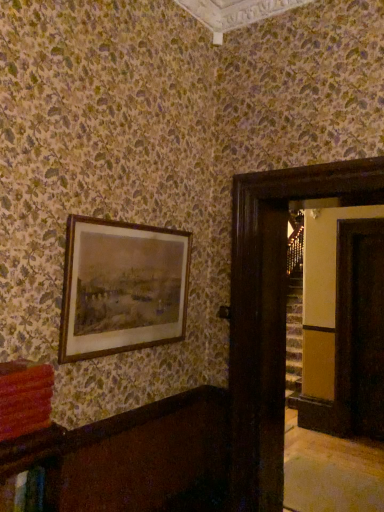
What is the approximate width of dark wood door at right, which ranks as the 2th glass door in right-to-left order?

dark wood door at right, which ranks as the 2th glass door in right-to-left order, is 19.11 inches wide.

This screenshot has height=512, width=384. What are the coordinates of `brown wooden picture frame at upper left` in the screenshot? It's located at (121, 287).

Is point (181, 289) positioned after point (1, 425)?

Yes, point (181, 289) is behind point (1, 425).

Which of these two, brown wooden picture frame at upper left or matte red book at lower left, is thinner?

brown wooden picture frame at upper left.

Does brown wooden picture frame at upper left appear on the right side of matte red book at lower left?

Indeed, brown wooden picture frame at upper left is positioned on the right side of matte red book at lower left.

Does brown wooden picture frame at upper left touch matte red book at lower left?

brown wooden picture frame at upper left is not next to matte red book at lower left, and they're not touching.

From the image's perspective, is transparent glass door at right, the second glass door from the left, below matte red book at lower left?

Indeed, from the image's perspective, transparent glass door at right, the second glass door from the left, is shown beneath matte red book at lower left.

Is transparent glass door at right, the second glass door from the left, bigger than matte red book at lower left?

Yes, transparent glass door at right, the second glass door from the left, is bigger than matte red book at lower left.

From a real-world perspective, is transparent glass door at right, arranged as the first glass door when viewed from the right, above or below matte red book at lower left?

Clearly, from a real-world perspective, transparent glass door at right, arranged as the first glass door when viewed from the right, is below matte red book at lower left.

From the picture: Considering the relative sizes of transparent glass door at right, arranged as the first glass door when viewed from the right, and matte red book at lower left in the image provided, is transparent glass door at right, arranged as the first glass door when viewed from the right, shorter than matte red book at lower left?

No.

Between brown wooden picture frame at upper left and dark wood door at right, which ranks as the 2th glass door in right-to-left order, which one appears on the left side from the viewer's perspective?

brown wooden picture frame at upper left.

Consider the image. From the image's perspective, is brown wooden picture frame at upper left beneath dark wood door at right, acting as the 2th glass door starting from the back?

Actually, brown wooden picture frame at upper left appears above dark wood door at right, acting as the 2th glass door starting from the back, in the image.

Is brown wooden picture frame at upper left completely or partially outside of dark wood door at right, which ranks as the 1th glass door in left-to-right order?

Yes, brown wooden picture frame at upper left is outside of dark wood door at right, which ranks as the 1th glass door in left-to-right order.

Considering the sizes of objects brown wooden picture frame at upper left and dark wood door at right, which ranks as the 1th glass door in left-to-right order, in the image provided, who is wider, brown wooden picture frame at upper left or dark wood door at right, which ranks as the 1th glass door in left-to-right order,?

Wider between the two is dark wood door at right, which ranks as the 1th glass door in left-to-right order.

Between matte red book at lower left and transparent glass door at right, the second glass door when ordered from front to back, which one has more height?

transparent glass door at right, the second glass door when ordered from front to back, is taller.

Is matte red book at lower left in front of or behind transparent glass door at right, the second glass door from the left, in the image?

Clearly, matte red book at lower left is in front of transparent glass door at right, the second glass door from the left.

Is matte red book at lower left turned away from transparent glass door at right, the second glass door from the left?

No, matte red book at lower left is not facing the opposite direction of transparent glass door at right, the second glass door from the left.

Is matte red book at lower left positioned far away from transparent glass door at right, the second glass door when ordered from front to back?

That's right, there is a large distance between matte red book at lower left and transparent glass door at right, the second glass door when ordered from front to back.

Between dark wood door at right, which ranks as the 1th glass door in left-to-right order, and brown wooden picture frame at upper left, which one has smaller width?

brown wooden picture frame at upper left is thinner.

Is brown wooden picture frame at upper left located within dark wood door at right, which ranks as the 1th glass door in left-to-right order?

No.

Is dark wood door at right, which ranks as the 1th glass door in left-to-right order, touching brown wooden picture frame at upper left?

They are not placed beside each other.

Considering the sizes of dark wood door at right, which ranks as the 2th glass door in right-to-left order, and brown wooden picture frame at upper left in the image, is dark wood door at right, which ranks as the 2th glass door in right-to-left order, bigger or smaller than brown wooden picture frame at upper left?

Considering their sizes, dark wood door at right, which ranks as the 2th glass door in right-to-left order, takes up more space than brown wooden picture frame at upper left.

From the image's perspective, between matte red book at lower left and dark wood door at right, acting as the 2th glass door starting from the back, who is located below?

dark wood door at right, acting as the 2th glass door starting from the back, from the image's perspective.

Consider the image. Considering the sizes of objects matte red book at lower left and dark wood door at right, which ranks as the 2th glass door in right-to-left order, in the image provided, who is taller, matte red book at lower left or dark wood door at right, which ranks as the 2th glass door in right-to-left order,?

dark wood door at right, which ranks as the 2th glass door in right-to-left order, is taller.

Considering their positions, is matte red book at lower left located in front of or behind dark wood door at right, placed as the first glass door when sorted from front to back?

matte red book at lower left is positioned closer to the viewer than dark wood door at right, placed as the first glass door when sorted from front to back.

Would you say matte red book at lower left is inside or outside dark wood door at right, which ranks as the 1th glass door in left-to-right order?

matte red book at lower left is outside dark wood door at right, which ranks as the 1th glass door in left-to-right order.

From a real-world perspective, is dark wood door at right, which ranks as the 1th glass door in left-to-right order, physically located above or below transparent glass door at right, which ranks as the 1th glass door in back-to-front order?

dark wood door at right, which ranks as the 1th glass door in left-to-right order, is situated higher than transparent glass door at right, which ranks as the 1th glass door in back-to-front order, in the real world.

How distant is dark wood door at right, placed as the first glass door when sorted from front to back, from transparent glass door at right, the second glass door from the left?

They are 6.45 feet apart.

Looking at their sizes, would you say dark wood door at right, which ranks as the 1th glass door in left-to-right order, is wider or thinner than transparent glass door at right, the second glass door from the left?

Considering their sizes, dark wood door at right, which ranks as the 1th glass door in left-to-right order, looks broader than transparent glass door at right, the second glass door from the left.

Is dark wood door at right, which ranks as the 1th glass door in left-to-right order, completely or partially outside of transparent glass door at right, the second glass door from the left?

Absolutely, dark wood door at right, which ranks as the 1th glass door in left-to-right order, is external to transparent glass door at right, the second glass door from the left.

In order to click on book in front of the brown wooden picture frame at upper left in this screenshot , I will do `click(25, 400)`.

I want to click on book above the transparent glass door at right, which ranks as the 1th glass door in back-to-front order (from the image's perspective), so (x=25, y=400).

Based on their spatial positions, is brown wooden picture frame at upper left or dark wood door at right, which ranks as the 1th glass door in left-to-right order, further from transparent glass door at right, which ranks as the 1th glass door in back-to-front order?

brown wooden picture frame at upper left lies further to transparent glass door at right, which ranks as the 1th glass door in back-to-front order, than the other object.

Which object lies further to the anchor point dark wood door at right, acting as the 2th glass door starting from the back, brown wooden picture frame at upper left or transparent glass door at right, the second glass door when ordered from front to back?

Based on the image, transparent glass door at right, the second glass door when ordered from front to back, appears to be further to dark wood door at right, acting as the 2th glass door starting from the back.

Considering their positions, is transparent glass door at right, which ranks as the 1th glass door in back-to-front order, positioned closer to brown wooden picture frame at upper left than dark wood door at right, placed as the first glass door when sorted from front to back?

The object closer to brown wooden picture frame at upper left is dark wood door at right, placed as the first glass door when sorted from front to back.

Which object lies further to the anchor point matte red book at lower left, transparent glass door at right, which ranks as the 1th glass door in back-to-front order, or brown wooden picture frame at upper left?

transparent glass door at right, which ranks as the 1th glass door in back-to-front order, lies further to matte red book at lower left than the other object.

Which object lies further to the anchor point dark wood door at right, which ranks as the 2th glass door in right-to-left order, transparent glass door at right, the second glass door from the left, or matte red book at lower left?

transparent glass door at right, the second glass door from the left, is positioned further to the anchor dark wood door at right, which ranks as the 2th glass door in right-to-left order.

When comparing their distances from matte red book at lower left, does brown wooden picture frame at upper left or dark wood door at right, which ranks as the 2th glass door in right-to-left order, seem further?

dark wood door at right, which ranks as the 2th glass door in right-to-left order, is positioned further to the anchor matte red book at lower left.

Which object lies further to the anchor point dark wood door at right, placed as the first glass door when sorted from front to back, transparent glass door at right, arranged as the first glass door when viewed from the right, or brown wooden picture frame at upper left?

The object further to dark wood door at right, placed as the first glass door when sorted from front to back, is transparent glass door at right, arranged as the first glass door when viewed from the right.

When comparing their distances from transparent glass door at right, the second glass door from the left, does brown wooden picture frame at upper left or matte red book at lower left seem further?

matte red book at lower left lies further to transparent glass door at right, the second glass door from the left, than the other object.

The image size is (384, 512). What are the coordinates of `glass door between brown wooden picture frame at upper left and transparent glass door at right, arranged as the first glass door when viewed from the right, along the z-axis` in the screenshot? It's located at (270, 296).

You are a GUI agent. You are given a task and a screenshot of the screen. Output one action in this format:
    pyautogui.click(x=<x>, y=<y>)
    Task: Click on the picture frame between matte red book at lower left and transparent glass door at right, the second glass door when ordered from front to back, along the z-axis
    Image resolution: width=384 pixels, height=512 pixels.
    Given the screenshot: What is the action you would take?
    pyautogui.click(x=121, y=287)

The width and height of the screenshot is (384, 512). I want to click on glass door positioned between matte red book at lower left and transparent glass door at right, the second glass door when ordered from front to back, from near to far, so click(x=270, y=296).

This screenshot has height=512, width=384. In order to click on picture frame situated between matte red book at lower left and dark wood door at right, placed as the first glass door when sorted from front to back, from left to right in this screenshot , I will do `click(121, 287)`.